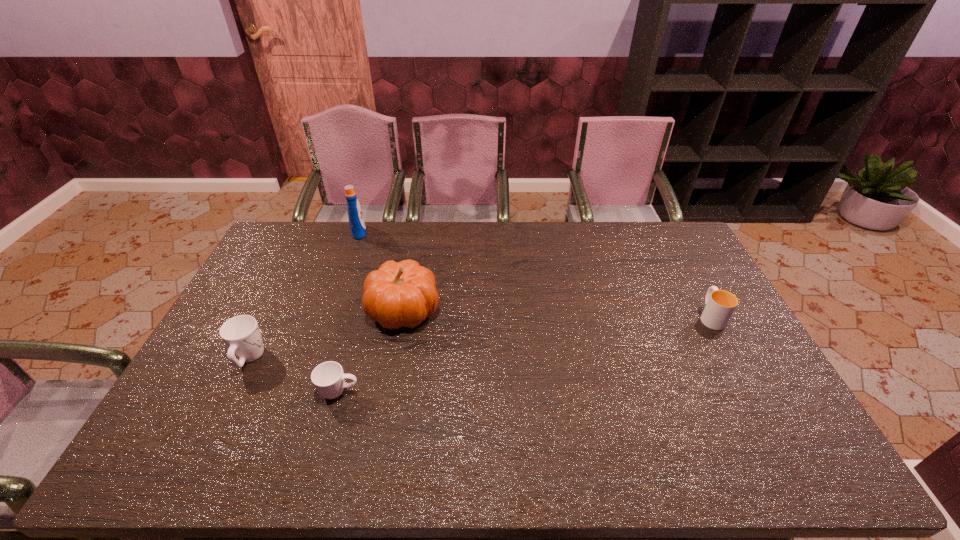
You are a GUI agent. You are given a task and a screenshot of the screen. Output one action in this format:
    pyautogui.click(x=<x>, y=<y>)
    Task: Click on the vacant space that satisfies the following two spatial constraints: 1. on the label of the tallest object; 2. with the handle on the side of the farther cup
    
    Given the screenshot: What is the action you would take?
    pyautogui.click(x=328, y=316)

Where is `vacant space that satisfies the following two spatial constraints: 1. with the handle on the side of the farther cup; 2. on the label of the farthest object`? Image resolution: width=960 pixels, height=540 pixels. vacant space that satisfies the following two spatial constraints: 1. with the handle on the side of the farther cup; 2. on the label of the farthest object is located at coordinates (664, 232).

Locate an element on the screen. The height and width of the screenshot is (540, 960). free point that satisfies the following two spatial constraints: 1. on the label of the second object from left to right; 2. with the handle on the side of the farther cup is located at coordinates (328, 316).